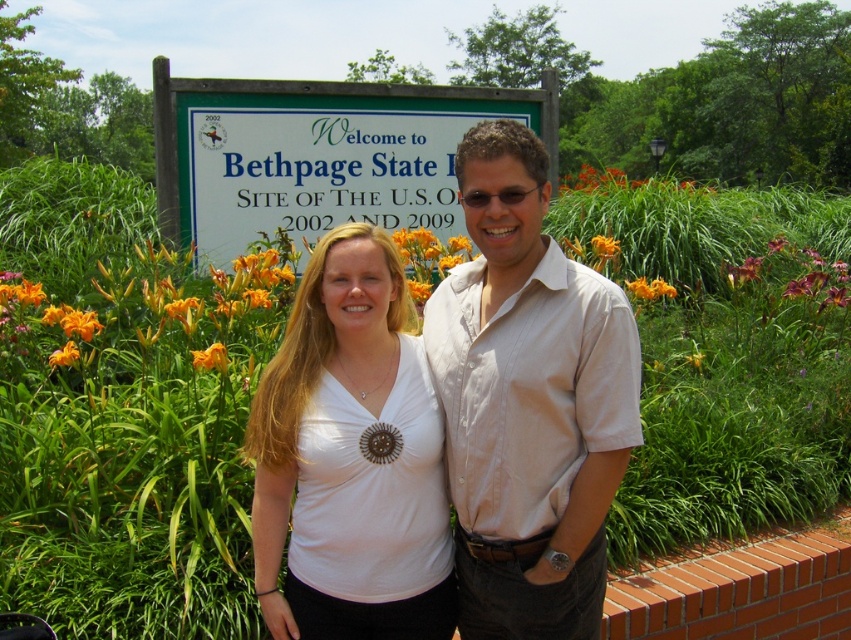
Question: Is green plastic sign at upper center bigger than orange matte flower at center-left?

Choices:
 (A) yes
 (B) no

Answer: (A)

Question: Which object is closer to the camera taking this photo?

Choices:
 (A) orange/yellow petals at center
 (B) orange matte flower at center-left
 (C) orange matte flower at center
 (D) orange petal at upper right

Answer: (C)

Question: Which of the following is the farthest from the observer?

Choices:
 (A) green plastic sign at upper center
 (B) orange/yellow petals at center

Answer: (A)

Question: Is orange petal at upper right above orange petal at center?

Choices:
 (A) no
 (B) yes

Answer: (B)

Question: Which of the following is the farthest from the observer?

Choices:
 (A) (198, 353)
 (B) (375, 280)

Answer: (A)

Question: Considering the relative positions of yellow petal at center and orange matte flower at center in the image provided, where is yellow petal at center located with respect to orange matte flower at center?

Choices:
 (A) below
 (B) above

Answer: (B)